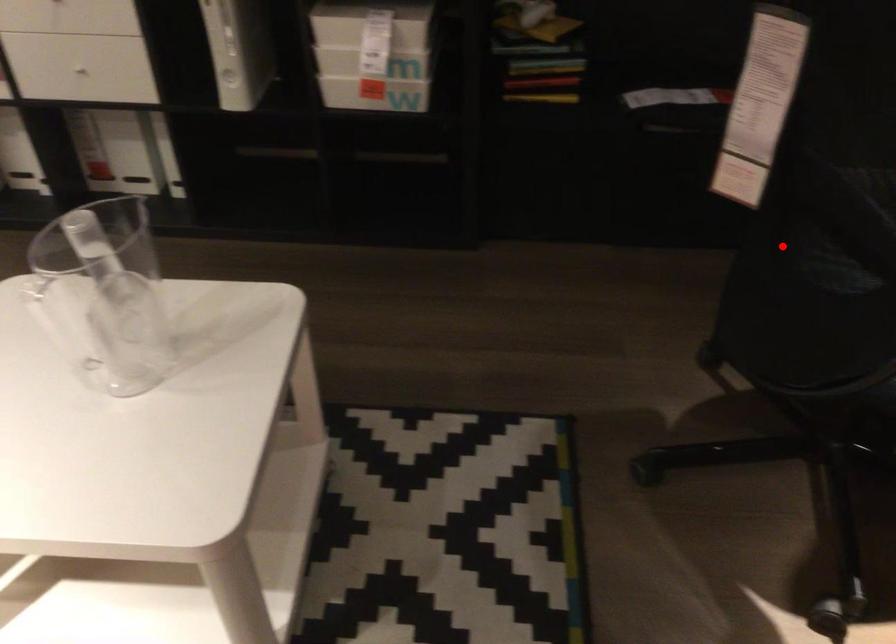
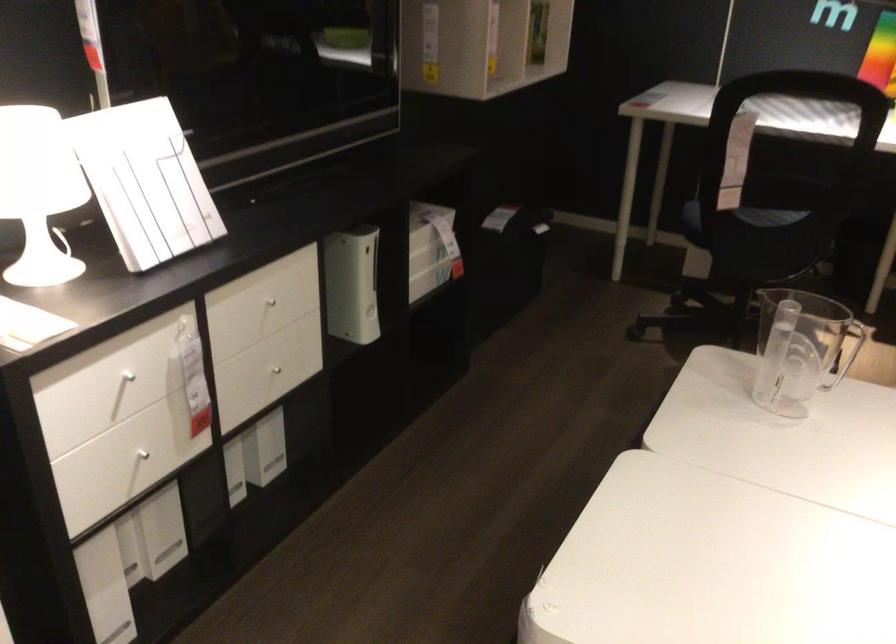
Question: I am providing you with two images of the same scene from different viewpoints. In image1, a red point is highlighted. Considering the same 3D point in image2, which of the following is correct?

Choices:
 (A) It is closer
 (B) It is farther

Answer: (B)